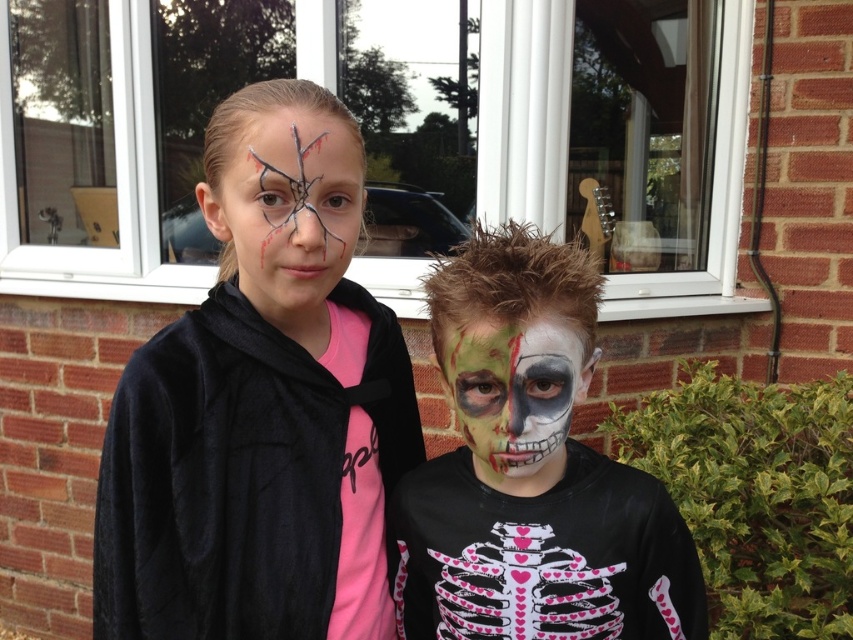
Which is above, matte black jacket at left or matte black face paint at upper center?

matte black face paint at upper center is above.

Can you confirm if matte black jacket at left is positioned above matte black face paint at upper center?

No, matte black jacket at left is not above matte black face paint at upper center.

Between point (279, 161) and point (346, 246), which one is positioned behind?

The point (346, 246) is behind.

The width and height of the screenshot is (853, 640). In order to click on matte black jacket at left in this screenshot , I will do `click(260, 404)`.

Does pink matte skeleton shirt at center appear under green matte face paint at center?

Yes, pink matte skeleton shirt at center is below green matte face paint at center.

Looking at this image, is pink matte skeleton shirt at center taller than green matte face paint at center?

Yes, pink matte skeleton shirt at center is taller than green matte face paint at center.

You are a GUI agent. You are given a task and a screenshot of the screen. Output one action in this format:
    pyautogui.click(x=<x>, y=<y>)
    Task: Click on the pink matte skeleton shirt at center
    The image size is (853, 640).
    Given the screenshot: What is the action you would take?
    [543, 556]

Is matte black face paint at upper center taller than green matte face paint at center?

Indeed, matte black face paint at upper center has a greater height compared to green matte face paint at center.

In order to click on matte black face paint at upper center in this screenshot , I will do `click(288, 205)`.

Who is more distant from viewer, [289,228] or [537,340]?

Point [289,228]

Identify the location of matte black face paint at upper center. This screenshot has height=640, width=853. (288, 205).